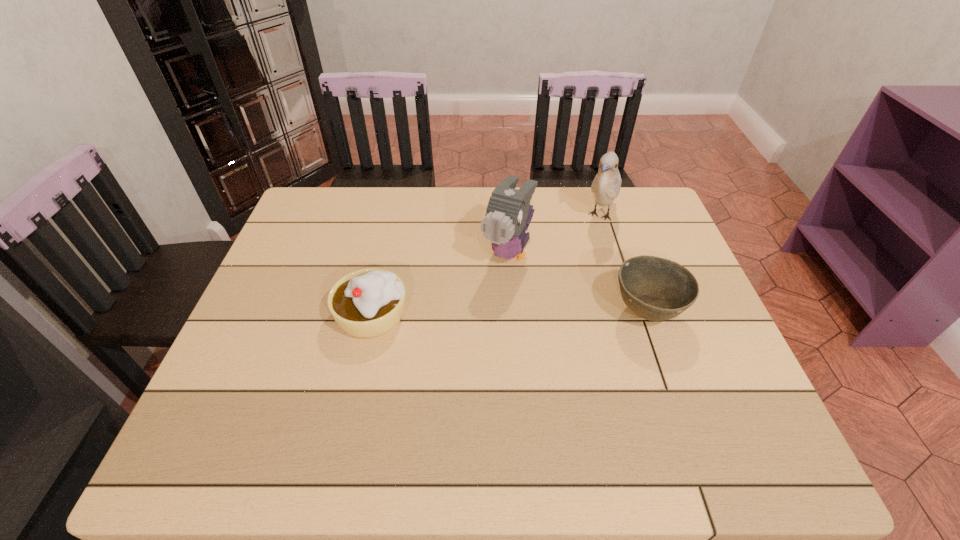
This screenshot has width=960, height=540. I want to click on vacant area located at the beak of the left bird, so (x=481, y=309).

This screenshot has width=960, height=540. I want to click on free space located 0.130m at the beak of the left bird, so click(x=478, y=314).

Find the location of a particular element. bowl at the right edge is located at coordinates (656, 289).

Find the location of `bird that is at the right edge`. bird that is at the right edge is located at coordinates (606, 185).

In order to click on object located at the far right corner in this screenshot , I will do `click(606, 185)`.

The height and width of the screenshot is (540, 960). I want to click on blank space at the far edge of the desktop, so click(563, 223).

I want to click on vacant space at the near edge, so click(x=469, y=383).

This screenshot has width=960, height=540. In the image, there is a desktop. Identify the location of vacant area at the left edge. (293, 254).

In the image, there is a desktop. Where is `vacant space at the right edge`? This screenshot has height=540, width=960. vacant space at the right edge is located at coordinates (676, 370).

In the image, there is a desktop. Where is `free space at the far left corner`? The image size is (960, 540). free space at the far left corner is located at coordinates (319, 211).